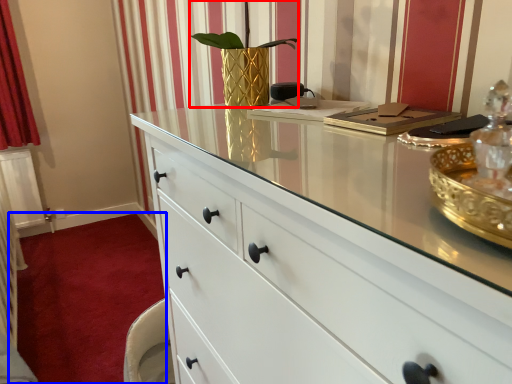
Question: Which object is further to the camera taking this photo, plant (highlighted by a red box) or plain (highlighted by a blue box)?

Choices:
 (A) plant
 (B) plain

Answer: (B)